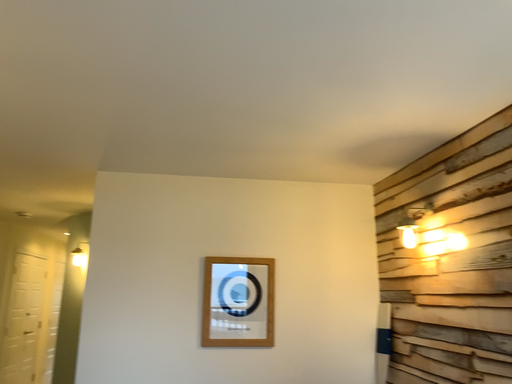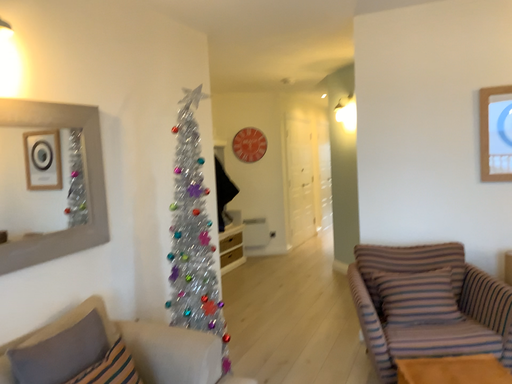
Question: Which way did the camera rotate in the video?

Choices:
 (A) rotated upward
 (B) rotated downward

Answer: (B)